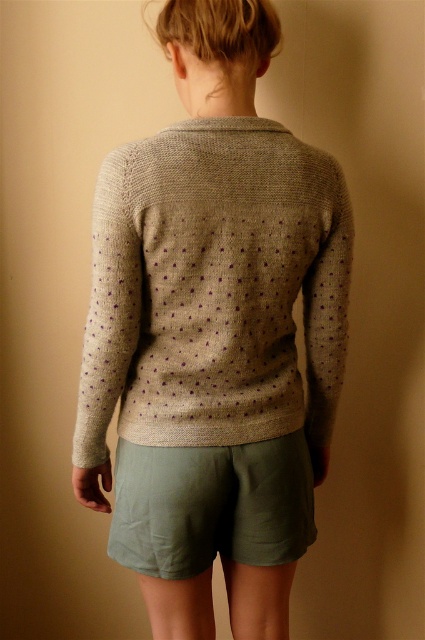
You are a fashion designer observing the image. You need to place a belt horizontally between the knitted beige cardigan at center and the olive green cotton shorts at lower center. Which side should the belt be placed closer to?

The knitted beige cardigan at center is to the right of olive green cotton shorts at lower center, so the belt should be placed closer to the knitted beige cardigan at center.

You are a fashion designer observing the image. You want to create a new outfit that includes both the knitted beige cardigan at center and the olive green cotton shorts at lower center. Which piece of clothing is longer in length?

The knitted beige cardigan at center is much taller than the olive green cotton shorts at lower center, so the cardigan is longer in length.